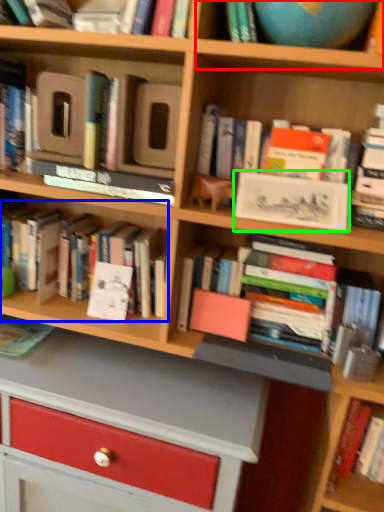
Question: Which object is positioned closest to shelf (highlighted by a red box)? Select from book (highlighted by a blue box) and paperback book (highlighted by a green box).

Choices:
 (A) book
 (B) paperback book

Answer: (B)